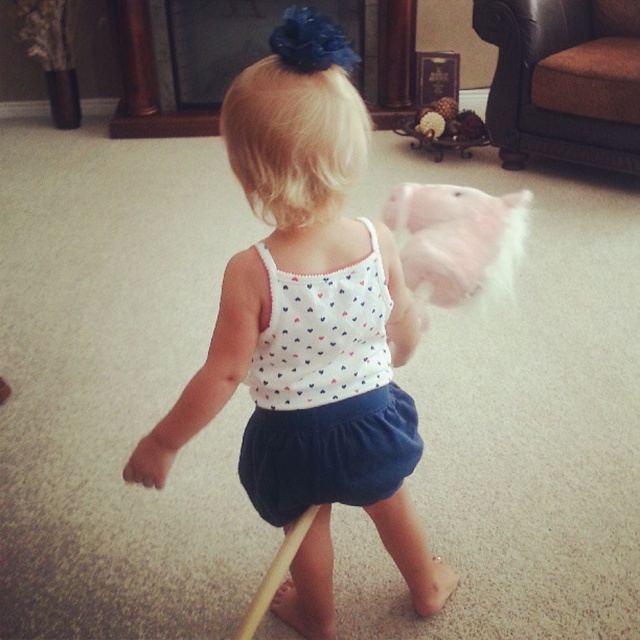
Does white dotted tank top at center appear on the left side of blue denim ballet skirt at center?

Yes, white dotted tank top at center is to the left of blue denim ballet skirt at center.

Which is behind, point (260, 333) or point (285, 451)?

Point (285, 451)

I want to click on white dotted tank top at center, so click(308, 328).

Who is lower down, white dotted fabric dress at center or fuzzy cotton candy at center?

white dotted fabric dress at center

Does white dotted fabric dress at center have a greater height compared to fuzzy cotton candy at center?

Yes.

What do you see at coordinates (324, 394) in the screenshot? The width and height of the screenshot is (640, 640). I see `white dotted fabric dress at center` at bounding box center [324, 394].

Where is `white dotted fabric dress at center`? The height and width of the screenshot is (640, 640). white dotted fabric dress at center is located at coordinates (324, 394).

Who is more distant from viewer, (332, 301) or (337, 148)?

Point (332, 301)

The height and width of the screenshot is (640, 640). What do you see at coordinates (324, 394) in the screenshot? I see `white dotted fabric dress at center` at bounding box center [324, 394].

Does point (378, 365) come behind point (237, 179)?

Yes, it is behind point (237, 179).

This screenshot has width=640, height=640. I want to click on white dotted fabric dress at center, so click(324, 394).